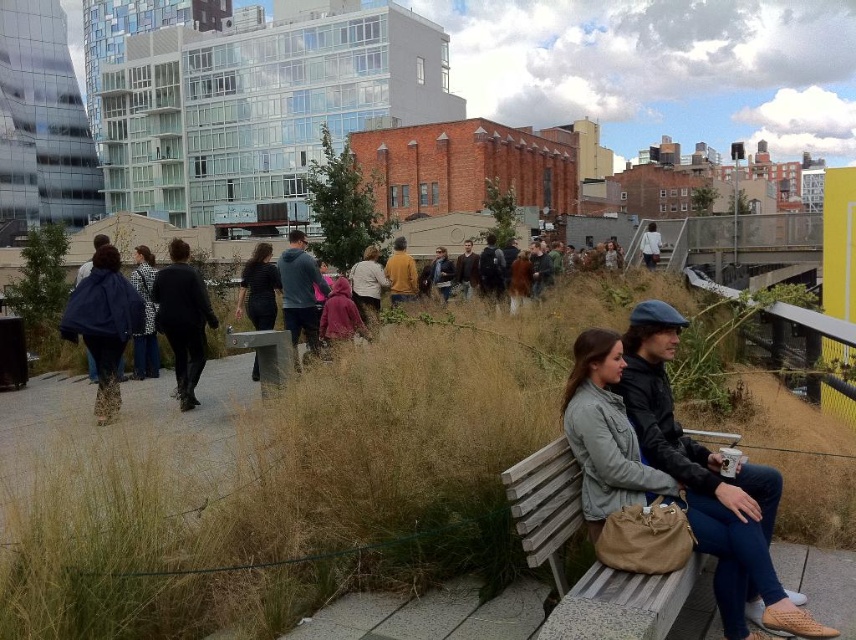
You are a photographer standing at the center of the walkway. You want to take a photo of the matte blue hoodie at center. Where should you aim your camera to capture it?

To capture the matte blue hoodie at center, aim your camera at the coordinates point (300, 291).

You are standing at the entrance of the park and see two items at the center of the scene. The velvet maroon coat at center and the dark brown backpack at center. Which one is closer to your left side?

The velvet maroon coat at center is to the left of dark brown backpack at center, so it is closer to your left side.

You are designing a new bench for the park and want to ensure it can accommodate both the matte blue hoodie at center and the mustard yellow sweater at center comfortably. Based on their sizes, which of the two requires more space on the bench?

The matte blue hoodie at center requires more space on the bench because its width is larger than that of the mustard yellow sweater at center.